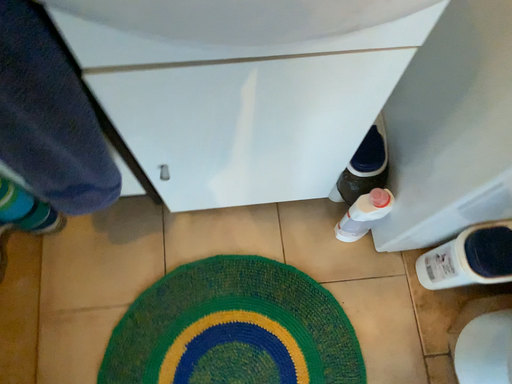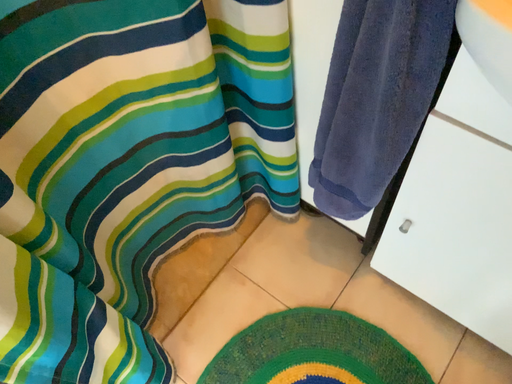
Question: Which way did the camera rotate in the video?

Choices:
 (A) rotated downward
 (B) rotated upward

Answer: (B)